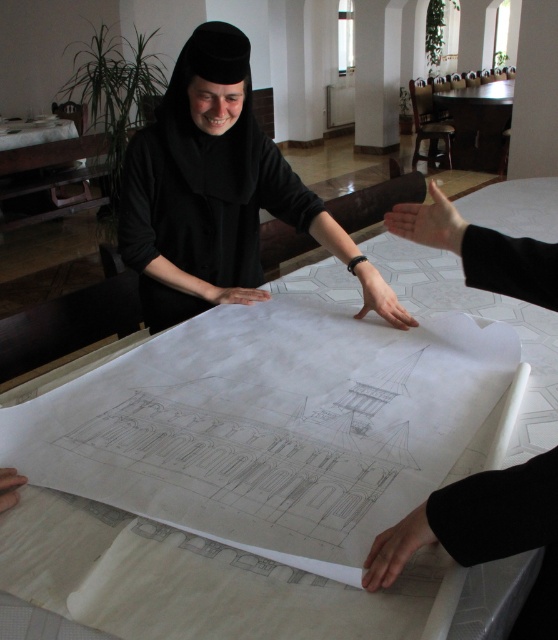
Does black matte hand at center have a greater height compared to smooth skin hand at lower left?

Yes.

Who is more forward, (455, 240) or (1, 490)?

Point (1, 490) is more forward.

Who is more forward, (421, 214) or (0, 483)?

Positioned in front is point (0, 483).

The height and width of the screenshot is (640, 558). I want to click on black matte hand at center, so click(429, 221).

Is point (507, 563) farther from camera compared to point (477, 102)?

No.

Identify the location of white paper at center. The image size is (558, 640). (160, 582).

Can you confirm if black matte hand at center is positioned above black matte hand at lower center?

Yes, black matte hand at center is above black matte hand at lower center.

Who is more forward, (455, 221) or (430, 529)?

Point (430, 529) is more forward.

Between point (391, 212) and point (371, 560), which one is positioned in front?

Point (371, 560)

Where is `black matte hand at center`? The height and width of the screenshot is (640, 558). black matte hand at center is located at coordinates (429, 221).